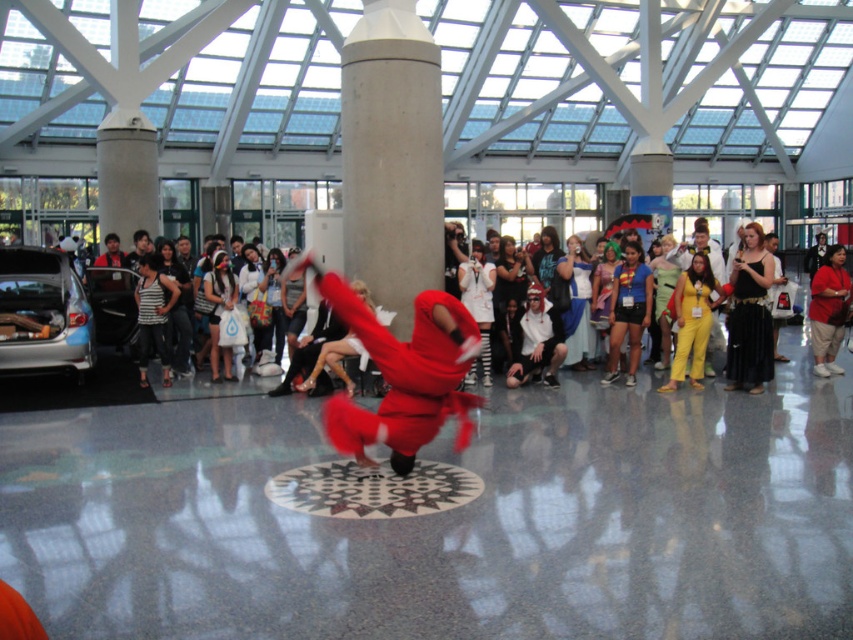
Question: Does silver metallic car at left have a greater width compared to black satin dress at right?

Choices:
 (A) no
 (B) yes

Answer: (B)

Question: Can you confirm if concrete pillar at center is bigger than matte red costume at center?

Choices:
 (A) no
 (B) yes

Answer: (B)

Question: Which point is farther from the camera taking this photo?

Choices:
 (A) (758, 314)
 (B) (369, 147)

Answer: (B)

Question: Can you confirm if matte red costume at center is bigger than black satin dress at right?

Choices:
 (A) no
 (B) yes

Answer: (B)

Question: Based on their relative distances, which object is nearer to the matte red costume at center?

Choices:
 (A) black satin dress at right
 (B) matte red pants at right
 (C) yellow fabric pants at center
 (D) silver metallic car at left

Answer: (C)

Question: Considering the real-world distances, which object is closest to the matte red costume at center?

Choices:
 (A) silver metallic car at left
 (B) black satin dress at right

Answer: (B)